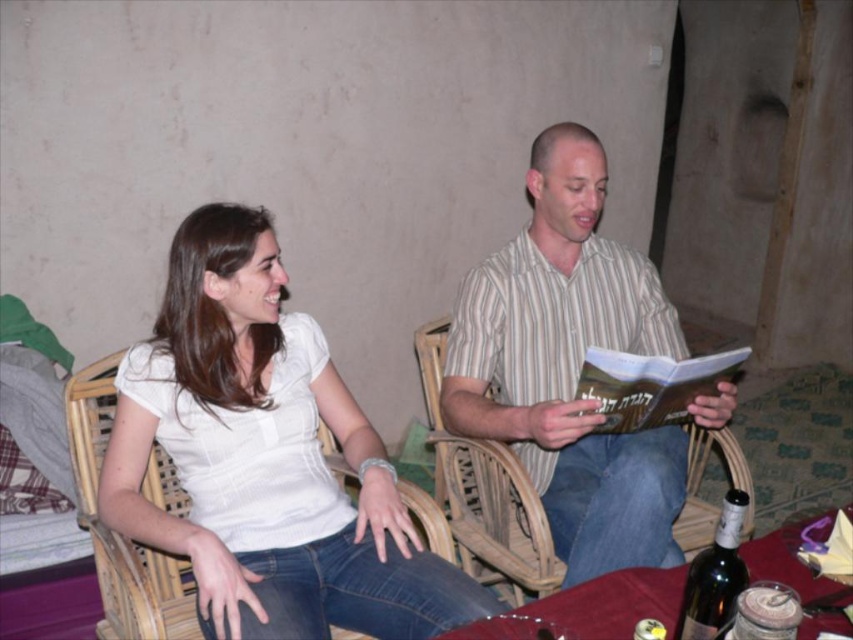
Who is lower down, white matte shirt at upper left or dark green glass bottle at lower right?

dark green glass bottle at lower right

Which is in front, point (318, 600) or point (738, 522)?

Point (738, 522) is more forward.

Between point (196, 544) and point (712, 602), which one is positioned behind?

The point (196, 544) is behind.

The image size is (853, 640). I want to click on white matte shirt at upper left, so click(265, 458).

Does striped cotton shirt at center appear over dark green glass bottle at lower right?

Indeed, striped cotton shirt at center is positioned over dark green glass bottle at lower right.

Which is behind, point (541, 140) or point (683, 625)?

Point (541, 140)

At what (x,y) coordinates should I click in order to perform the action: click on striped cotton shirt at center. Please return your answer as a coordinate pair (x, y). Looking at the image, I should click on (569, 365).

Locate an element on the screen. striped cotton shirt at center is located at coordinates (569, 365).

In order to click on white matte shirt at upper left in this screenshot , I will do `click(265, 458)`.

In order to click on white matte shirt at upper left in this screenshot , I will do point(265,458).